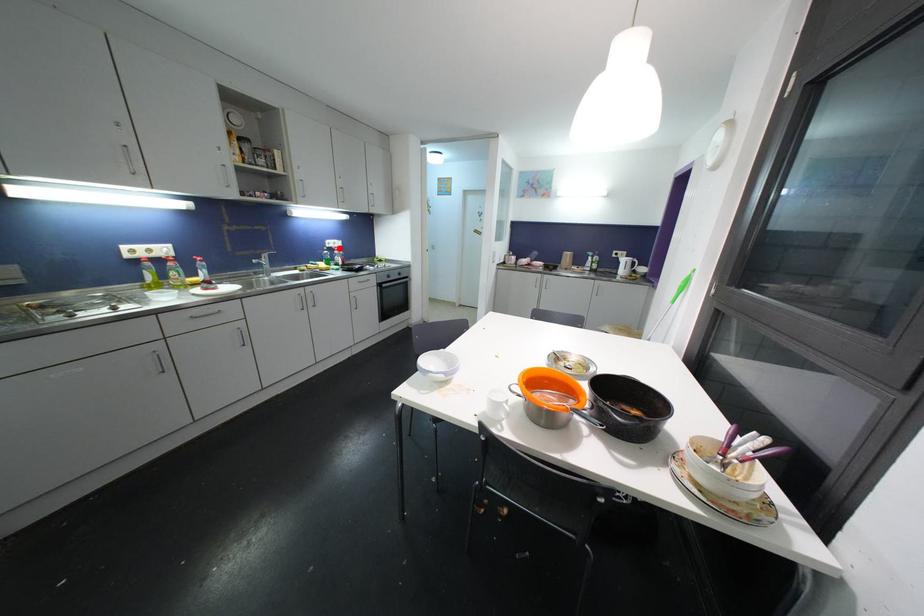
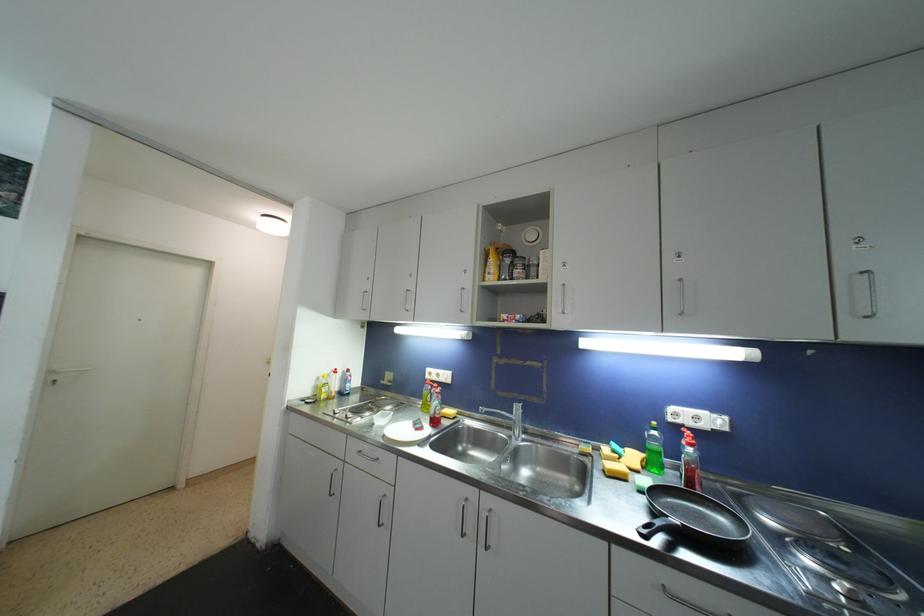
Question: I am providing you with two images of the same scene from different viewpoints. In image1, a red point is highlighted. Considering the same 3D point in image2, which of the following is correct?

Choices:
 (A) It is closer
 (B) It is farther

Answer: (B)